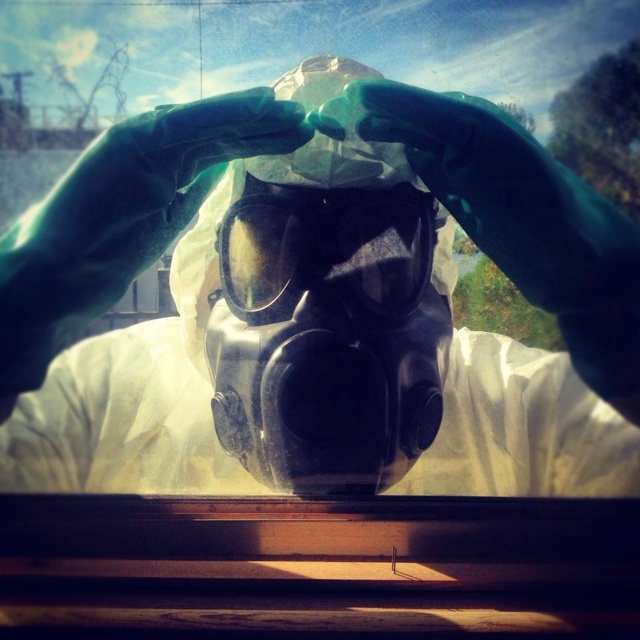
Is the position of black matte gas mask at center more distant than that of transparent plastic goggles at center?

No, it is not.

Who is more distant from viewer, (x=301, y=260) or (x=353, y=243)?

Point (x=353, y=243)

Is point (234, 276) farther from camera compared to point (385, 296)?

Yes, it is behind point (385, 296).

At what (x,y) coordinates should I click in order to perform the action: click on black matte gas mask at center. Please return your answer as a coordinate pair (x, y). Looking at the image, I should click on (326, 336).